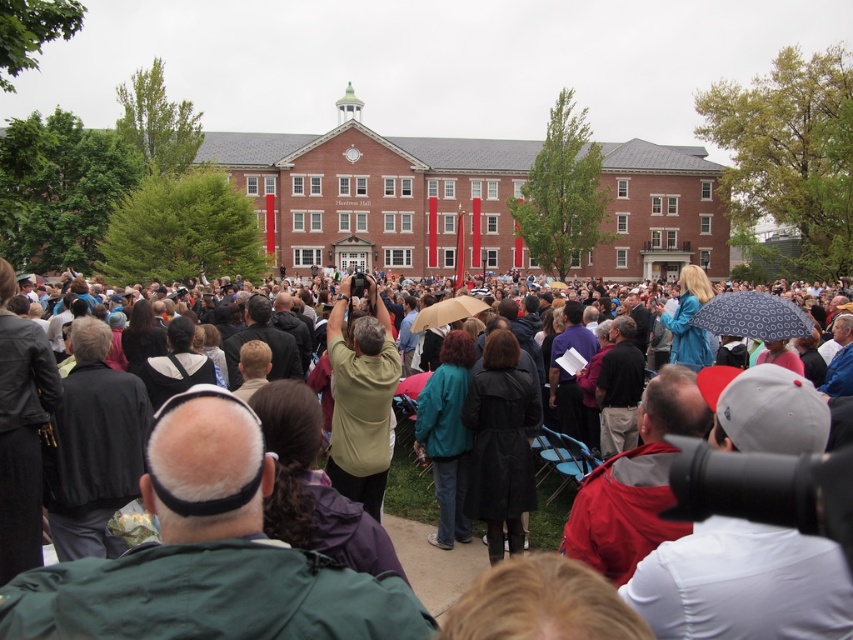
Question: Is dark gray coat at center to the left of matte green shirt at center from the viewer's perspective?

Choices:
 (A) yes
 (B) no

Answer: (B)

Question: In this image, where is dark gray coat at center located relative to matte green shirt at center?

Choices:
 (A) left
 (B) right

Answer: (B)

Question: Which point is closer to the camera?

Choices:
 (A) dark gray coat at center
 (B) matte green shirt at center

Answer: (A)

Question: Is dark gray coat at center thinner than matte green shirt at center?

Choices:
 (A) no
 (B) yes

Answer: (A)

Question: Which point is closer to the camera taking this photo?

Choices:
 (A) (328, 458)
 (B) (567, 486)

Answer: (A)